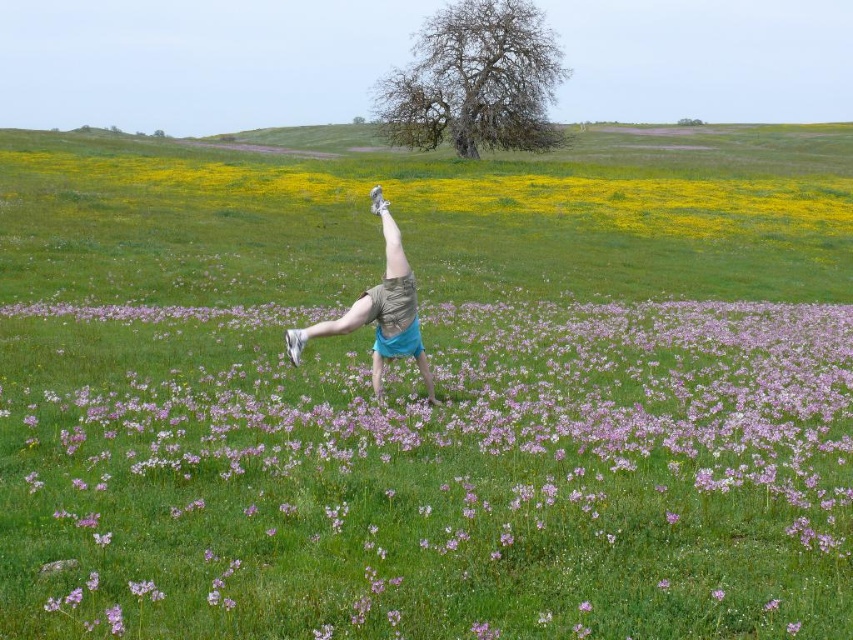
You are a drone operator tasked with capturing aerial footage of the yellow matte flower at upper center and light blue shorts at center. Your drone has a maximum flight range of 30 meters. Can the drone safely capture footage of both objects without exceeding its range?

The distance between the yellow matte flower at upper center and light blue shorts at center is 32.31 meters. Since the drone has a maximum flight range of 30 meters, it cannot safely capture footage of both objects without exceeding its range.